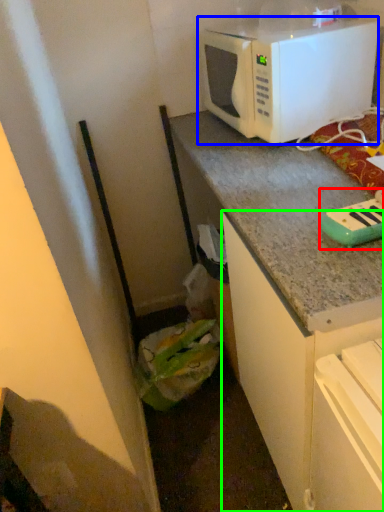
Question: Which object is the farthest from appliance (highlighted by a red box)? Choose among these: microwave oven (highlighted by a blue box) or cabinetry (highlighted by a green box).

Choices:
 (A) microwave oven
 (B) cabinetry

Answer: (A)